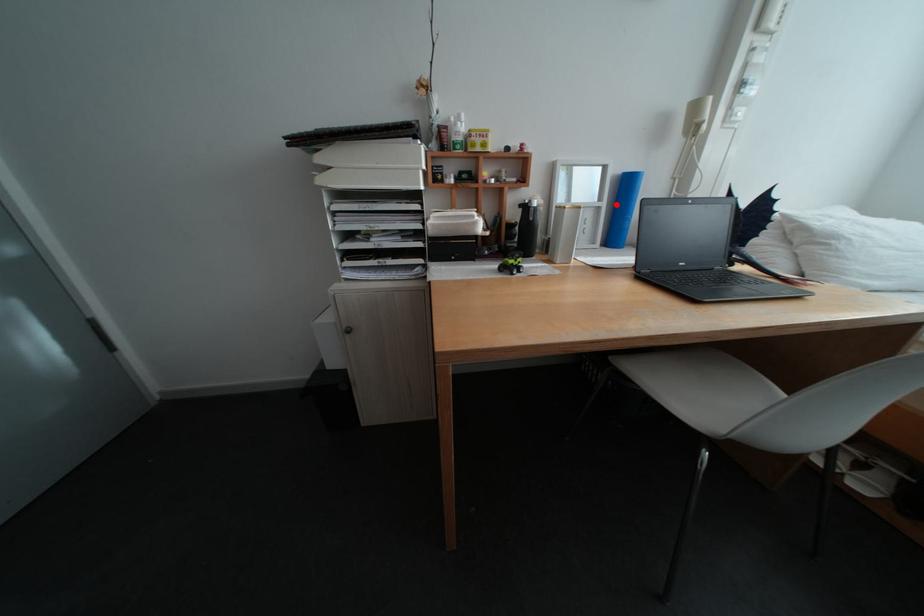
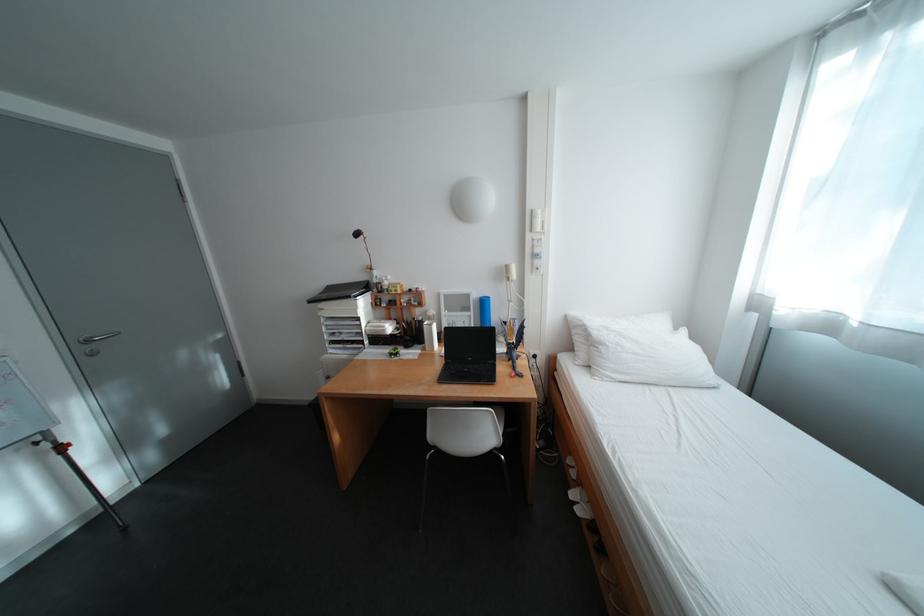
Find the pixel in the second image that matches the highlighted location in the first image.

(484, 314)